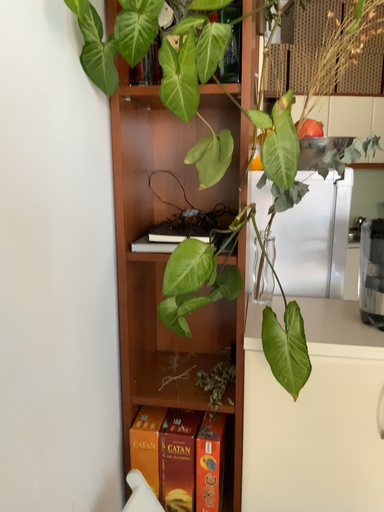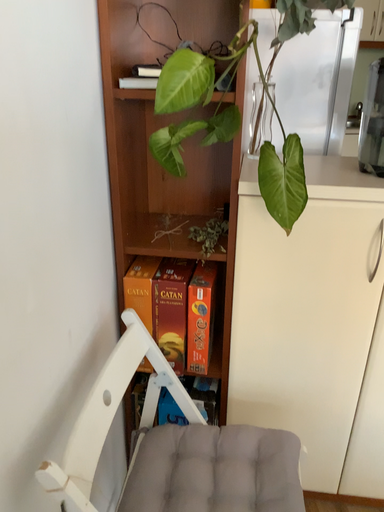
Question: Which way did the camera rotate in the video?

Choices:
 (A) rotated downward
 (B) rotated upward

Answer: (A)